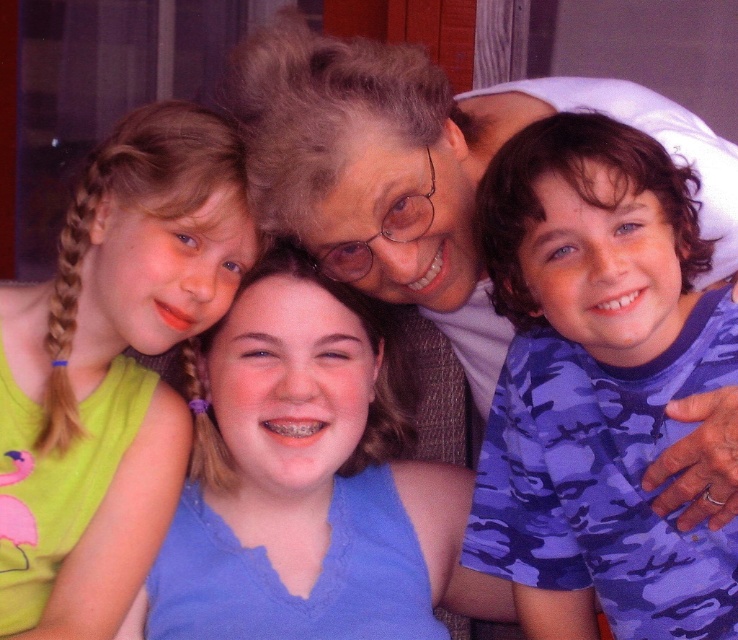
You are a photographer trying to capture a candid shot of the camouflage shirt at right and the matte black glasses at center. You need to ensure both subjects are in focus. Given that your camera has a depth of field that can cover 20 centimeters, will you be able to capture both subjects clearly in the same shot?

The camouflage shirt at right and matte black glasses at center are 21.95 centimeters apart. Since the distance between them exceeds the camera sensor depth of field of 20 centimeters, the photographer might struggle to keep both in focus simultaneously. Adjusting the aperture or focusing on a midpoint could help achieve better clarity for both subjects.

You are a photographer standing in front of the scene. You need to capture a photo of the matte black glasses at center and the green fabric shirt at left. The camera you are using has a focal length of 50mm. To ensure both objects are in focus, what is the minimum distance you should be from the scene?

The minimum distance should be at least 11.60 inches divided by the crop factor of the camera sensor. Assuming a full frame sensor, the crop factor is 1, so the minimum distance is 11.60 inches. This ensures both objects are within the depth of field.